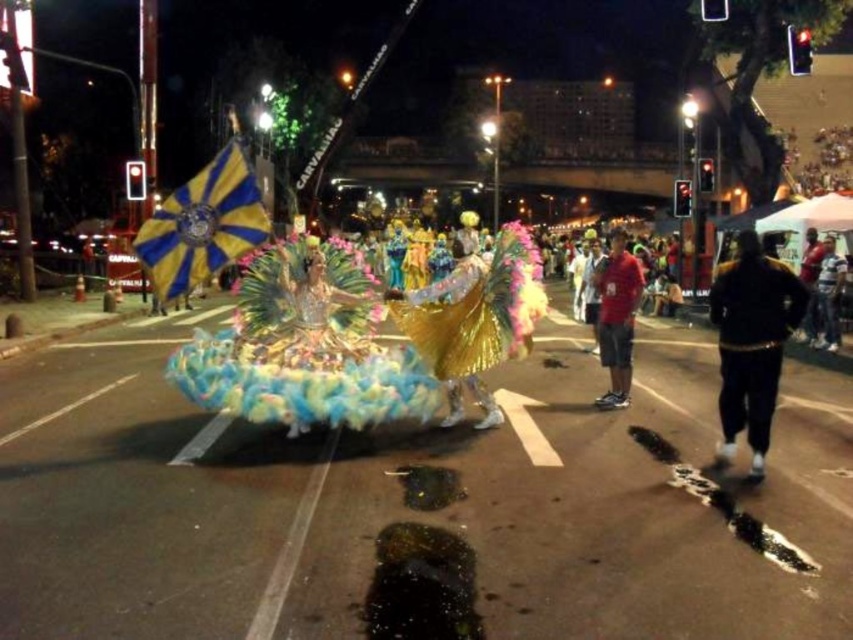
Question: Which object is closer to the camera taking this photo?

Choices:
 (A) black leather jacket at right
 (B) red matte shirt at center
 (C) shiny gold costume at center

Answer: (C)

Question: Does shiny gold costume at center appear under white cotton shirt at right?

Choices:
 (A) no
 (B) yes

Answer: (B)

Question: Among these objects, which one is farthest from the camera?

Choices:
 (A) shiny gold costume at center
 (B) red matte shirt at center

Answer: (B)

Question: Which object is the closest to the black leather jacket at right?

Choices:
 (A) white cotton shirt at right
 (B) red matte shirt at center

Answer: (A)

Question: Is black smooth tracksuit at lower right above black leather jacket at right?

Choices:
 (A) no
 (B) yes

Answer: (A)

Question: Does shiny gold costume at center have a smaller size compared to white cotton shirt at right?

Choices:
 (A) no
 (B) yes

Answer: (A)